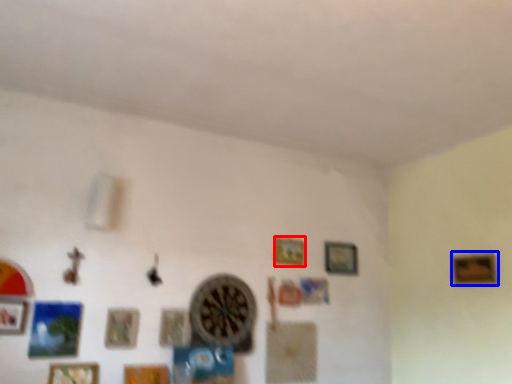
Question: Among these objects, which one is farthest to the camera, picture frame (highlighted by a red box) or picture frame (highlighted by a blue box)?

Choices:
 (A) picture frame
 (B) picture frame

Answer: (A)